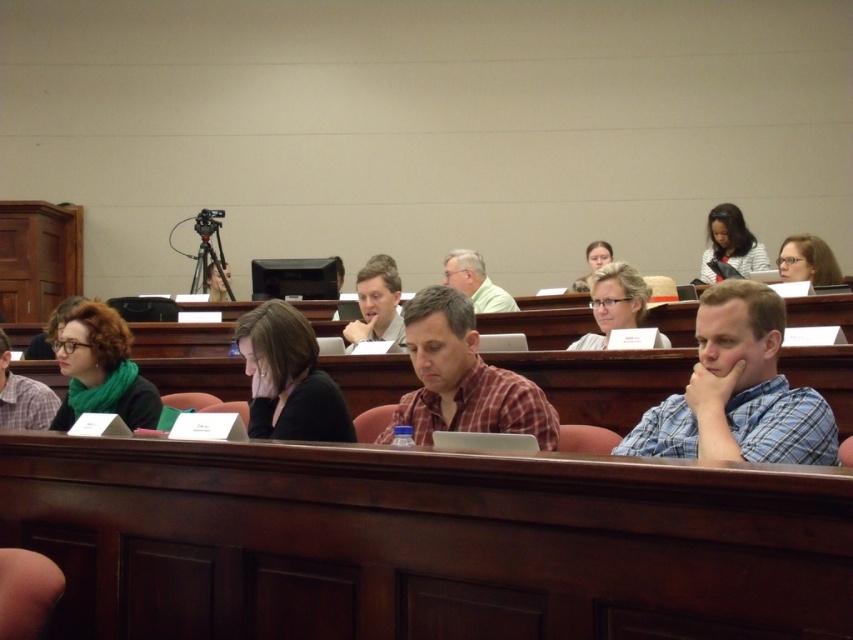
You are a student in the classroom and need to place your matte black glasses at center and matte black laptop at upper right on your desk. Which object will occupy more vertical space on your desk?

The matte black laptop at upper right will occupy more vertical space on your desk since it has a greater height than the matte black glasses at center.

You are standing at the entrance of the classroom and want to place a large poster on the wall directly behind the wooden table at center. Based on the coordinates provided, can you determine if the poster will fit vertically if it is 1.5 meters tall?

The wooden table at center is located at coordinates point (602, 381). Since the poster is 1.5 meters tall, it is necessary to know the height of the wall behind the table to determine if it can fit vertically. However, the provided information does not include the height of the wall, so we cannot confirm if the poster will fit.